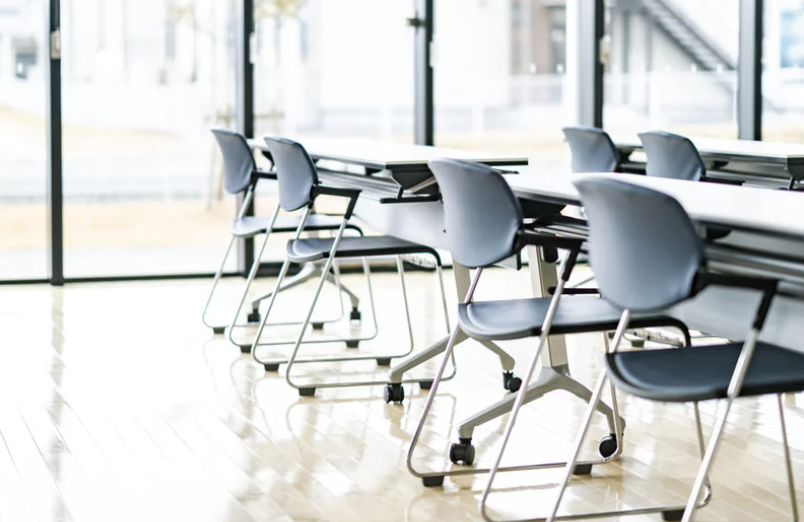
Find the location of `chair wheels`. chair wheels is located at coordinates (260, 311), (355, 308), (402, 389), (507, 375), (457, 448), (609, 434).